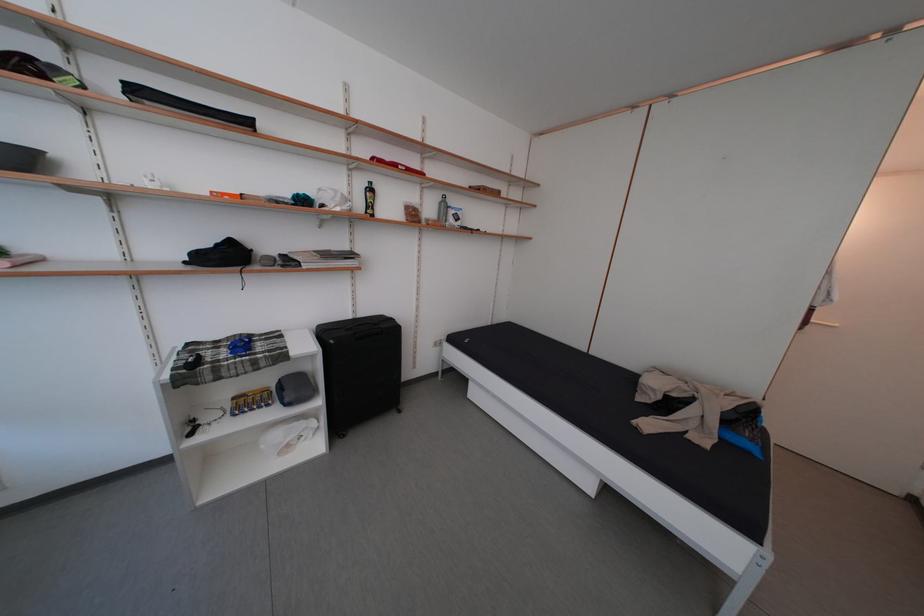
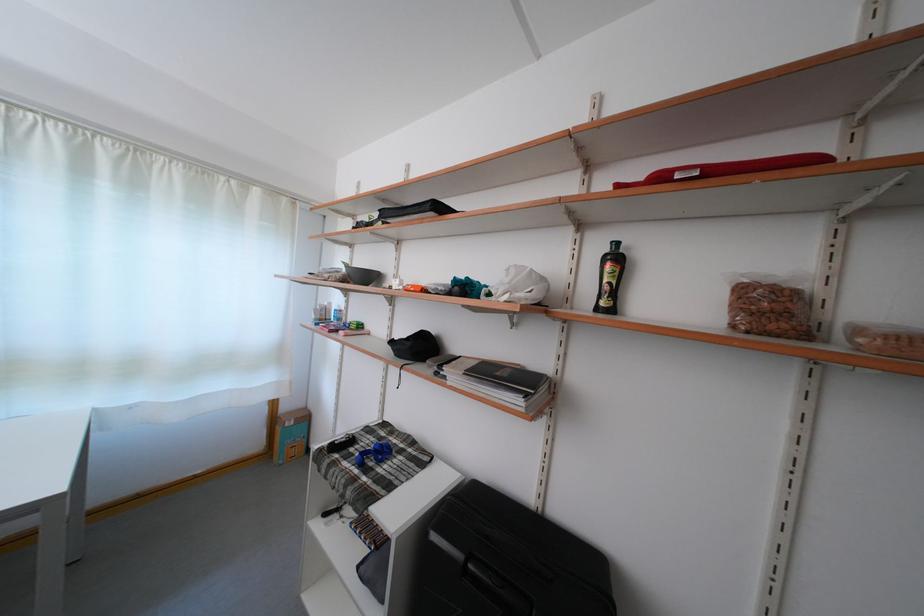
Find the pixel in the second image that matches pixel 375 220 in the first image.

(606, 314)